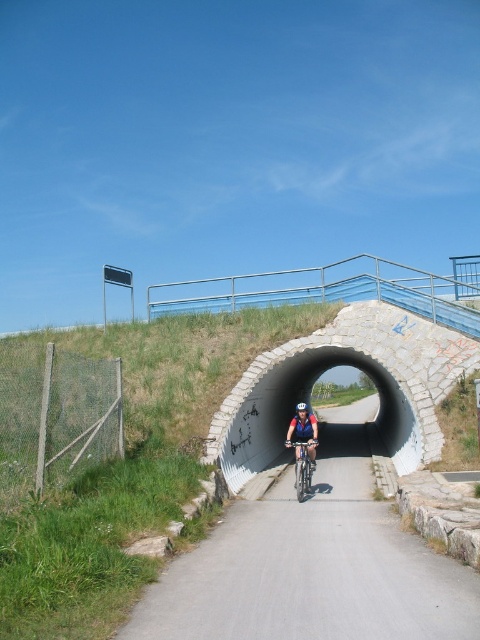
You are a photographer positioned at the tunnel entrance. You see the matte blue helmet at center and the white matte bicycle helmet at center. Which helmet appears closer to you in the image?

The matte blue helmet at center appears closer to you because it is positioned further to the viewer than the white matte bicycle helmet at center.

You are a cyclist preparing to enter a tunnel. You notice the matte blue helmet at center and the shiny metallic bicycle at center. How far apart are these two items?

The matte blue helmet at center is 10.46 inches from the shiny metallic bicycle at center.

You are standing at the entrance of the tunnel and want to place two markers on the road. The first marker should be placed at point (286,444) and the second at point (299,410). Which marker will appear closer to you when viewed from the tunnel entrance?

Point (286,444) is closer to the viewer than point (299,410), so the first marker placed at point (286,444) will appear closer to you when viewed from the tunnel entrance.